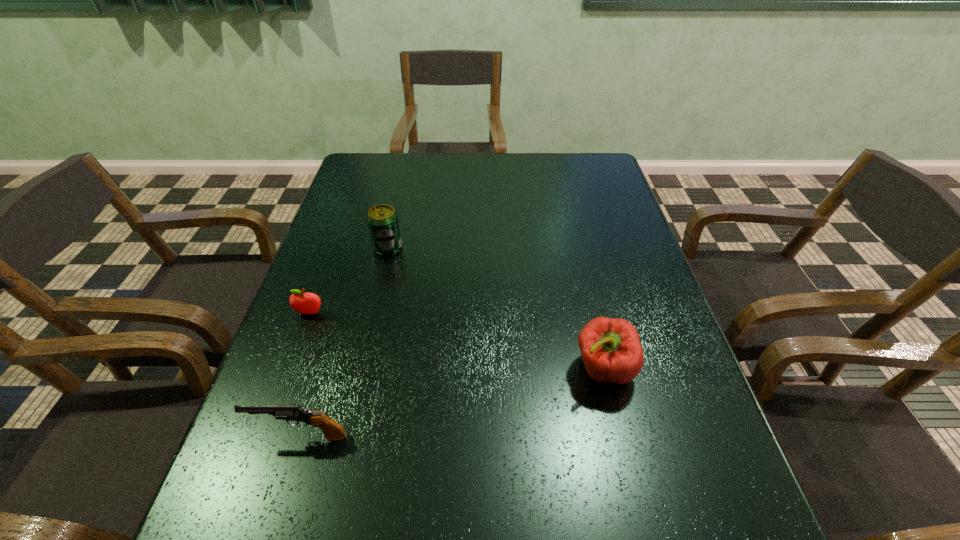
The height and width of the screenshot is (540, 960). I want to click on blank region between the beer can and the shortest object, so tap(348, 280).

Where is `free space between the gun and the second nearest object`? The width and height of the screenshot is (960, 540). free space between the gun and the second nearest object is located at coordinates (452, 402).

I want to click on free space between the bell pepper and the nearest object, so click(452, 402).

Image resolution: width=960 pixels, height=540 pixels. I want to click on free space between the shortest object and the third farthest object, so click(457, 341).

The width and height of the screenshot is (960, 540). What are the coordinates of `free space between the apple and the gun` in the screenshot? It's located at (305, 374).

Find the location of a particular element. The width and height of the screenshot is (960, 540). unoccupied area between the gun and the farthest object is located at coordinates (344, 342).

At what (x,y) coordinates should I click in order to perform the action: click on vacant space that's between the bell pepper and the farthest object. Please return your answer as a coordinate pair (x, y). Looking at the image, I should click on (495, 308).

The image size is (960, 540). In order to click on vacant area that lies between the rightmost object and the farthest object in this screenshot , I will do `click(495, 308)`.

At what (x,y) coordinates should I click in order to perform the action: click on empty space that is in between the nearest object and the third farthest object. Please return your answer as a coordinate pair (x, y). The width and height of the screenshot is (960, 540). Looking at the image, I should click on (452, 402).

Identify the location of object that ranks as the closest to the bell pepper. The width and height of the screenshot is (960, 540). (332, 430).